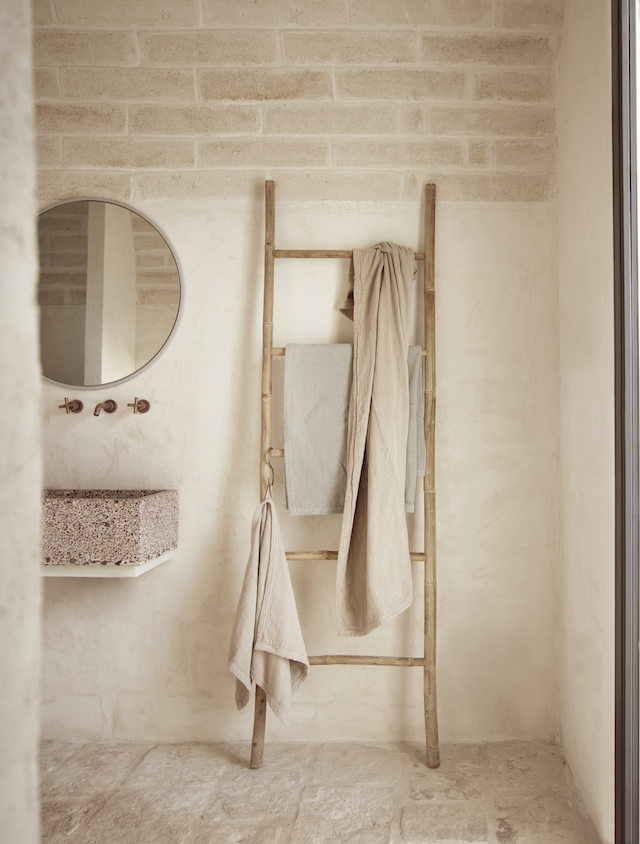
Image resolution: width=640 pixels, height=844 pixels. In order to click on empty space below ladder in this screenshot , I will do `click(326, 803)`.